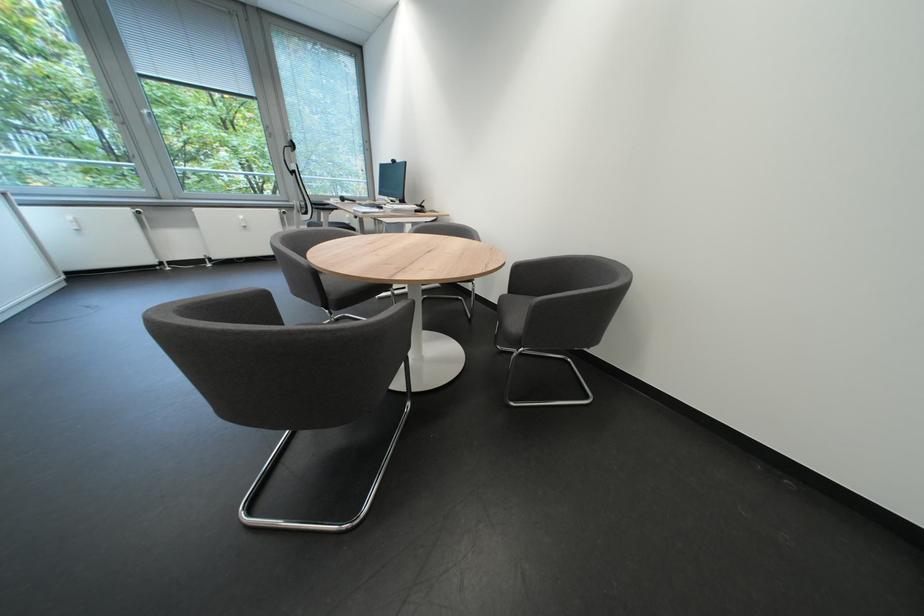
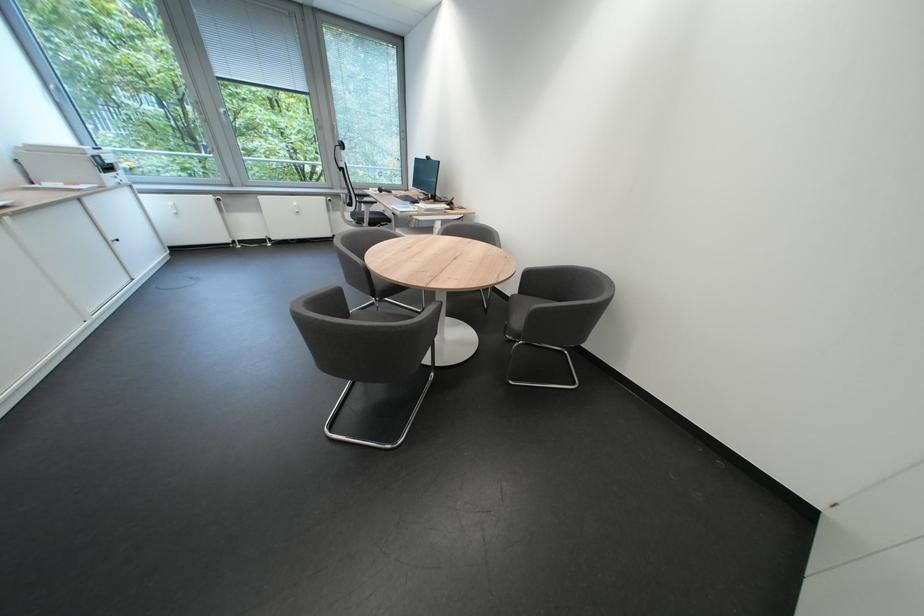
Locate, in the second image, the point that corresponds to the point at 330,209 in the first image.

(372, 204)